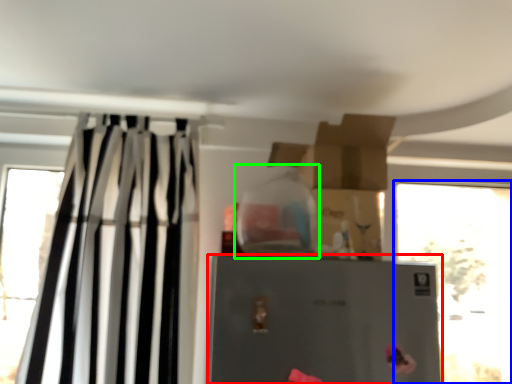
Question: Estimate the real-world distances between objects in this image. Which object is closer to refrigerator (highlighted by a red box), window (highlighted by a blue box) or bottle (highlighted by a green box)?

Choices:
 (A) window
 (B) bottle

Answer: (B)